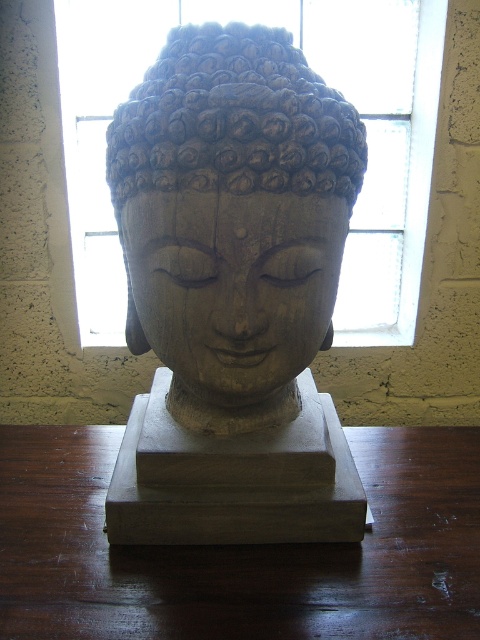
You are standing in front of the Buddha sculpture and want to place a small offering on the brown wood table at center. Based on your current position, where should you move to reach the table?

The brown wood table at center is located at coordinates point (240, 550), so you should move towards that point to reach the table.